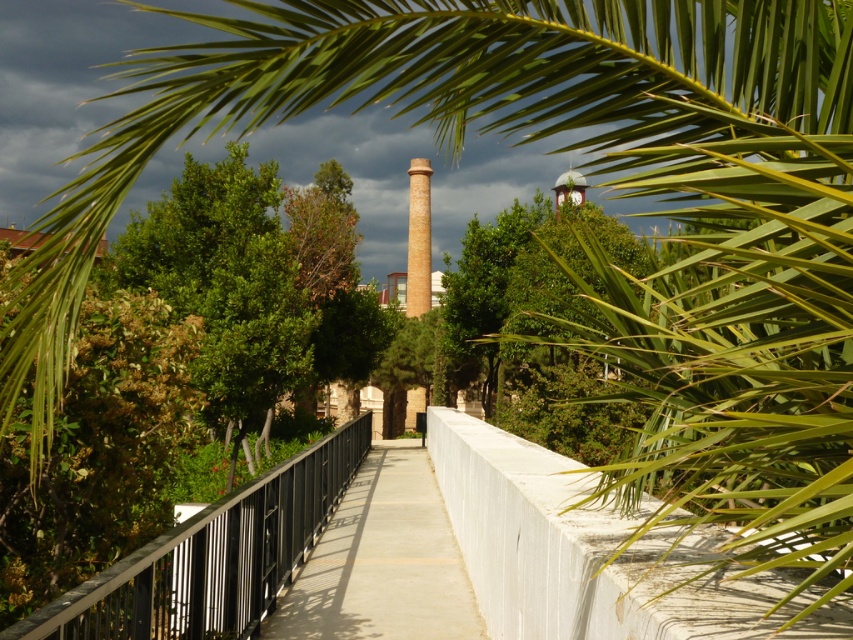
Question: Which point is closer to the camera?

Choices:
 (A) (231, 504)
 (B) (310, 580)

Answer: (A)

Question: Does black metal railing at center appear over concrete sidewalk at center?

Choices:
 (A) no
 (B) yes

Answer: (B)

Question: Among these points, which one is nearest to the camera?

Choices:
 (A) (347, 568)
 (B) (309, 493)

Answer: (A)

Question: Can you confirm if black metal railing at center is thinner than concrete sidewalk at center?

Choices:
 (A) no
 (B) yes

Answer: (B)

Question: Considering the relative positions of black metal railing at center and concrete sidewalk at center in the image provided, where is black metal railing at center located with respect to concrete sidewalk at center?

Choices:
 (A) below
 (B) above

Answer: (B)